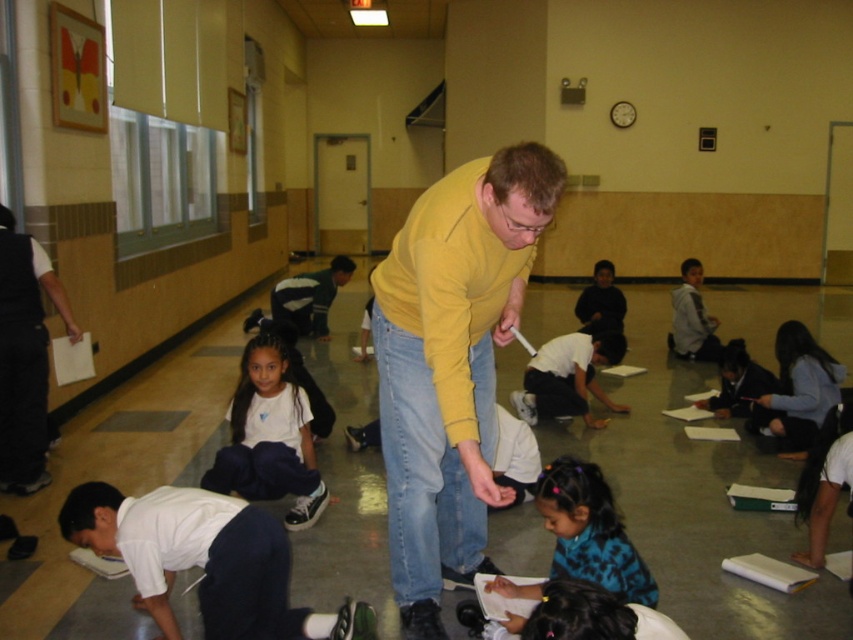
Question: Can you confirm if black vest at left is positioned to the right of white matte shirt at center?

Choices:
 (A) no
 (B) yes

Answer: (A)

Question: Does white smooth shirt at lower left appear on the right side of black vest at left?

Choices:
 (A) no
 (B) yes

Answer: (B)

Question: Which of these objects is positioned farthest from the white matte shirt at center?

Choices:
 (A) black vest at left
 (B) white matte shirt at lower left
 (C) white smooth shirt at lower left

Answer: (C)

Question: Which object is farther from the camera taking this photo?

Choices:
 (A) white matte shirt at lower left
 (B) yellow matte sweater at center
 (C) white smooth shirt at lower left
 (D) black vest at left

Answer: (D)

Question: Which point is farther to the camera?

Choices:
 (A) white matte shirt at center
 (B) black vest at left
 (C) yellow matte sweater at center
 (D) white smooth shirt at lower left

Answer: (A)

Question: Is yellow matte sweater at center positioned at the back of black vest at left?

Choices:
 (A) yes
 (B) no

Answer: (B)